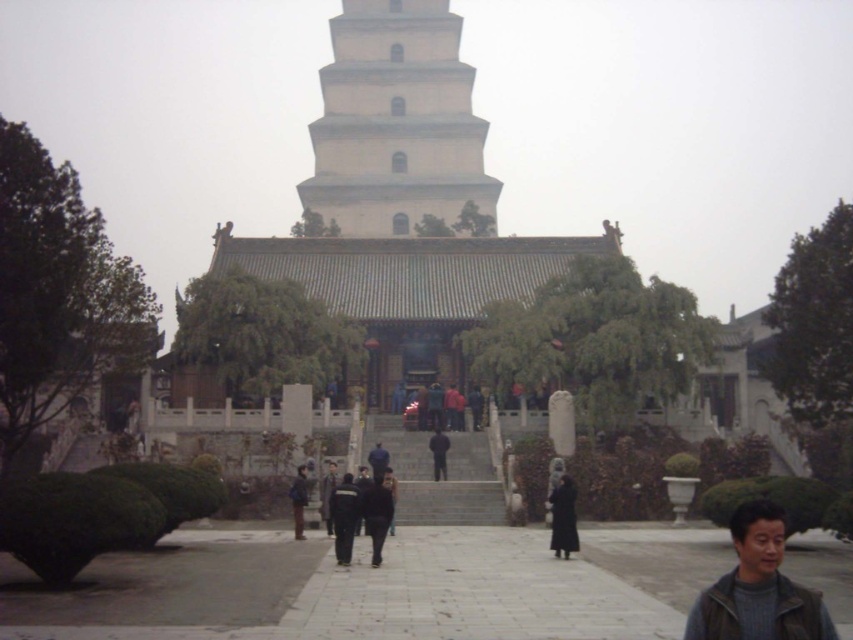
You are standing at the entrance of the pagoda and want to greet both the person wearing the dark gray fabric jacket at center and the person wearing the black matte coat at center. Which person should you approach first if you want to minimize the total distance walked?

You should approach the person wearing the dark gray fabric jacket at center first because they are only 37.18 feet away from the black matte coat at center, so the total distance would be shorter if you go to the closer one first.

You are a photographer at the temple site and want to capture both the dark gray fabric jacket at center and the black matte coat at center in a single frame. Since you want both to be clearly visible, which object should you focus on to ensure the larger one is in sharp focus?

The dark gray fabric jacket at center is larger in size than the black matte coat at center, so you should focus on the dark gray fabric jacket at center to ensure it is in sharp focus.